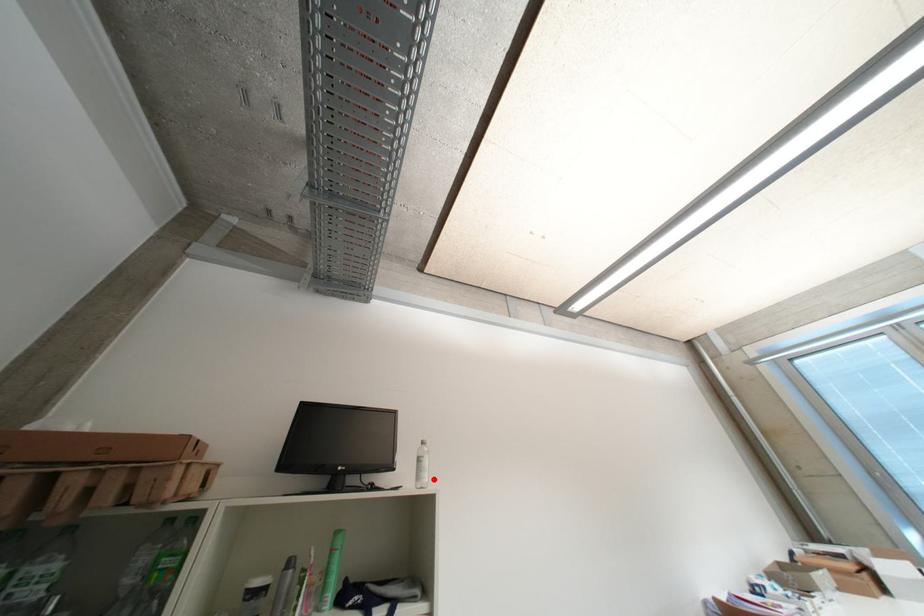
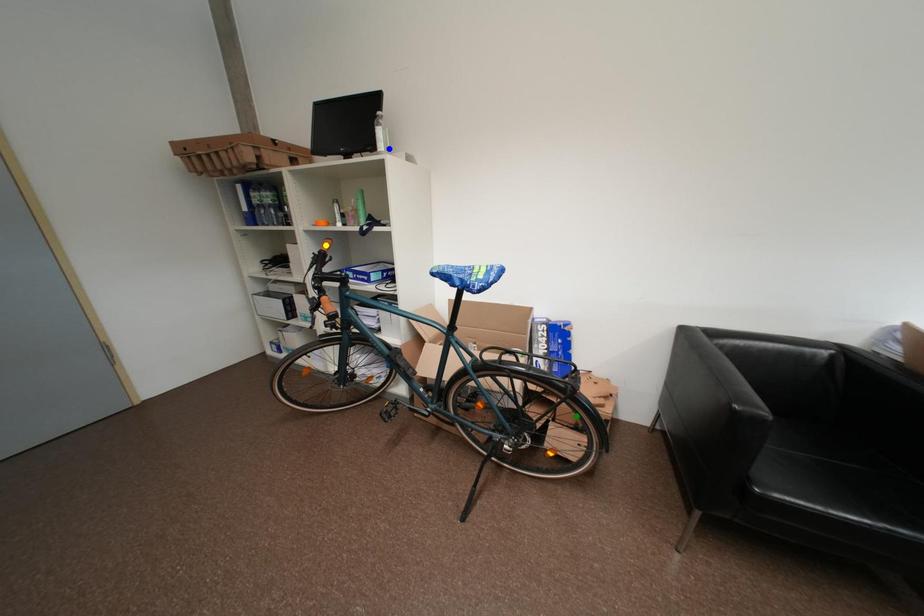
Question: I am providing you with two images of the same scene from different viewpoints. A red point is marked on the first image. You are given multiple points on the second image. Which point in image 2 represents the same 3d spot as the red point in image 1?

Choices:
 (A) green point
 (B) yellow point
 (C) blue point

Answer: (C)